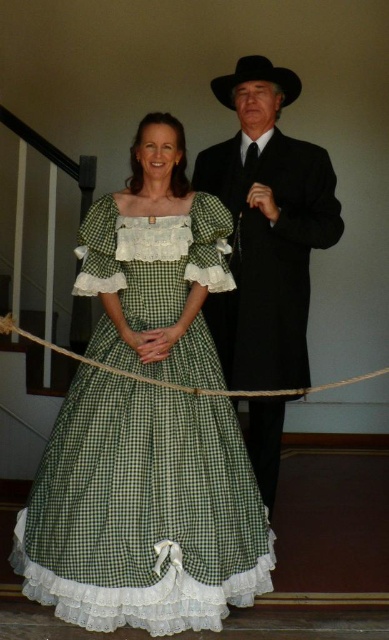
You are a costume designer preparing for a historical play. You have two items in front of you, the green checkered dress at center and the black felt cowboy hat at upper center. Which item would require more fabric to make?

The green checkered dress at center requires more fabric to make because it has a larger size compared to the black felt cowboy hat at upper center.

You are a costume designer preparing for a play. You have two props to place on a mannequin stand that can only hold items up to 1 meter in height. The matte black suit at center and the black felt cowboy hat at upper center are both available. Can both items be placed on the stand without exceeding the height limit?

The matte black suit at center has a larger size compared to the black felt cowboy hat at upper center. Since the stand can hold items up to 1 meter in height, and the larger suit would occupy more space, it is possible both can fit if the combined height does not exceed the limit. However, without specific height measurements, we cannot confirm definitively. Please ensure the total height of both items together is under 1 meter.